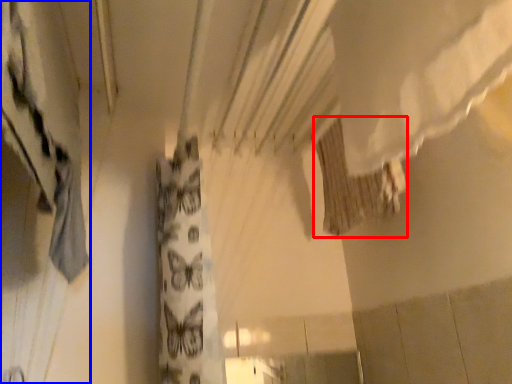
Question: Among these objects, which one is farthest to the camera, shower curtain (highlighted by a red box) or curtain (highlighted by a blue box)?

Choices:
 (A) shower curtain
 (B) curtain

Answer: (A)